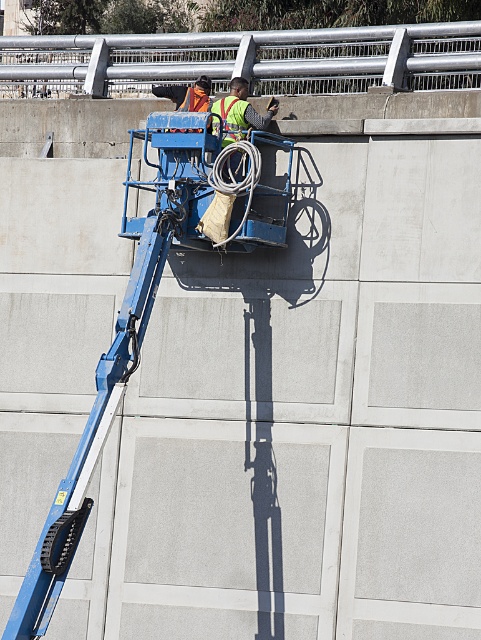
Question: Can you confirm if reflective safety vest at upper center is positioned to the right of reflective yellow safety vest at center?

Choices:
 (A) yes
 (B) no

Answer: (B)

Question: Does reflective safety vest at upper center appear under reflective yellow safety vest at center?

Choices:
 (A) no
 (B) yes

Answer: (A)

Question: Does reflective safety vest at upper center appear under reflective yellow safety vest at center?

Choices:
 (A) no
 (B) yes

Answer: (A)

Question: Which object appears farthest from the camera in this image?

Choices:
 (A) reflective yellow safety vest at center
 (B) reflective safety vest at upper center

Answer: (B)